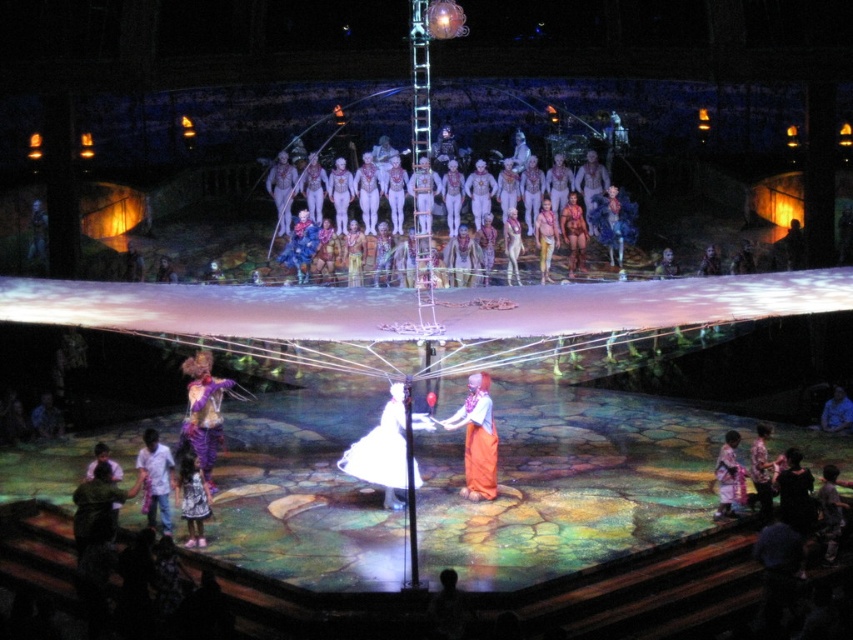
Question: Estimate the real-world distances between objects in this image. Which object is closer to the white cotton shirt at lower left?

Choices:
 (A) white matte bodies at center
 (B) printed cotton dress at lower left
 (C) orange fabric at center

Answer: (B)

Question: Among these points, which one is nearest to the camera?

Choices:
 (A) (184, 483)
 (B) (138, 468)
 (C) (416, 216)
 (D) (735, 484)

Answer: (A)

Question: Which object appears farthest from the camera in this image?

Choices:
 (A) white matte bodies at center
 (B) orange fabric at center

Answer: (A)

Question: Is white cotton shirt at lower left above patterned fabric dress at lower right?

Choices:
 (A) yes
 (B) no

Answer: (B)

Question: Where is orange fabric at center located in relation to patterned fabric dress at lower right in the image?

Choices:
 (A) below
 (B) above

Answer: (B)

Question: Is white satin dress at center further to camera compared to printed cotton dress at lower left?

Choices:
 (A) yes
 (B) no

Answer: (B)